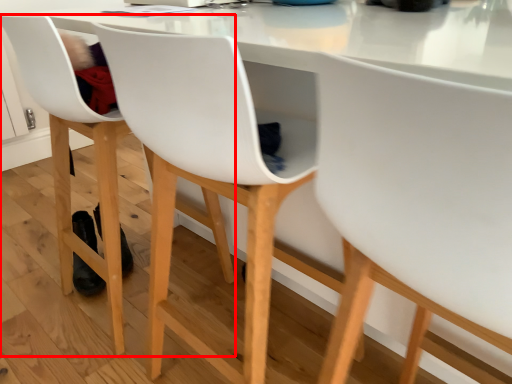
Question: Considering the relative positions of chair (annotated by the red box) and chair in the image provided, where is chair (annotated by the red box) located with respect to the staircase?

Choices:
 (A) right
 (B) left

Answer: (B)